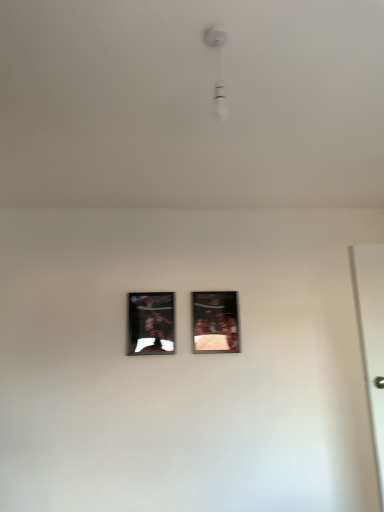
Question: In which direction should I rotate to look at metallic reflective frame at center, which is counted as the second picture frame, starting from the right?

Choices:
 (A) right
 (B) left

Answer: (B)

Question: Is metallic silver picture frame at center, which is counted as the 1th picture frame, starting from the right, at the right side of metallic reflective frame at center, the 1th picture frame when ordered from left to right?

Choices:
 (A) yes
 (B) no

Answer: (A)

Question: Is metallic silver picture frame at center, which appears as the second picture frame when viewed from the left, behind metallic reflective frame at center, the 1th picture frame when ordered from left to right?

Choices:
 (A) yes
 (B) no

Answer: (A)

Question: Is metallic silver picture frame at center, which is counted as the 1th picture frame, starting from the right, oriented towards metallic reflective frame at center, which is counted as the second picture frame, starting from the right?

Choices:
 (A) no
 (B) yes

Answer: (A)

Question: Considering the relative sizes of metallic silver picture frame at center, which is counted as the 1th picture frame, starting from the right, and metallic reflective frame at center, which is counted as the second picture frame, starting from the right, in the image provided, is metallic silver picture frame at center, which is counted as the 1th picture frame, starting from the right, wider than metallic reflective frame at center, which is counted as the second picture frame, starting from the right,?

Choices:
 (A) yes
 (B) no

Answer: (A)

Question: Could metallic reflective frame at center, the 1th picture frame when ordered from left to right, be considered to be inside metallic silver picture frame at center, which is counted as the 1th picture frame, starting from the right?

Choices:
 (A) no
 (B) yes

Answer: (A)

Question: Is metallic silver picture frame at center, which is counted as the 1th picture frame, starting from the right, not near metallic reflective frame at center, the 1th picture frame when ordered from left to right?

Choices:
 (A) yes
 (B) no

Answer: (B)

Question: Can you confirm if white glossy bulb at upper center is wider than metallic silver picture frame at center, which appears as the second picture frame when viewed from the left?

Choices:
 (A) yes
 (B) no

Answer: (A)

Question: Can you confirm if white glossy bulb at upper center is thinner than metallic silver picture frame at center, which is counted as the 1th picture frame, starting from the right?

Choices:
 (A) no
 (B) yes

Answer: (A)

Question: From a real-world perspective, is white glossy bulb at upper center below metallic silver picture frame at center, which is counted as the 1th picture frame, starting from the right?

Choices:
 (A) no
 (B) yes

Answer: (A)

Question: Does white glossy bulb at upper center lie behind metallic silver picture frame at center, which appears as the second picture frame when viewed from the left?

Choices:
 (A) no
 (B) yes

Answer: (A)

Question: Does white glossy bulb at upper center contain metallic silver picture frame at center, which appears as the second picture frame when viewed from the left?

Choices:
 (A) yes
 (B) no

Answer: (B)

Question: Is white glossy bulb at upper center at the left side of metallic silver picture frame at center, which is counted as the 1th picture frame, starting from the right?

Choices:
 (A) no
 (B) yes

Answer: (B)

Question: Is metallic silver picture frame at center, which is counted as the 1th picture frame, starting from the right, further to camera compared to white glossy bulb at upper center?

Choices:
 (A) yes
 (B) no

Answer: (A)